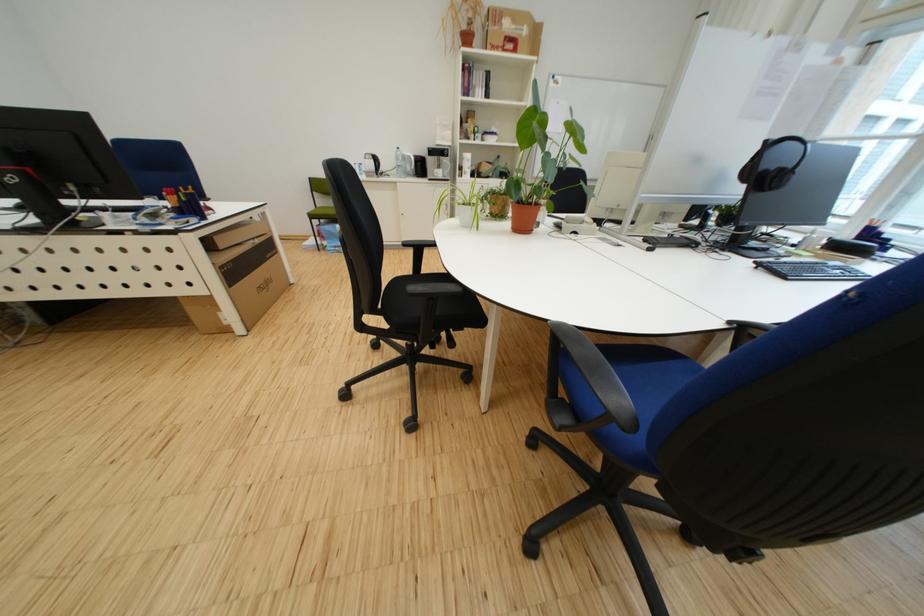
Locate an element on the screen. The width and height of the screenshot is (924, 616). white electric kettle is located at coordinates (406, 163).